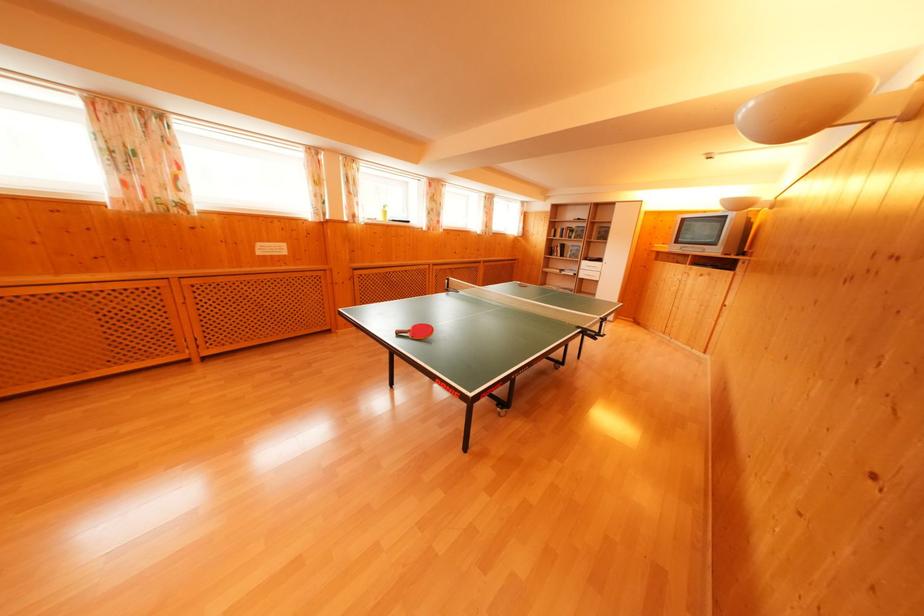
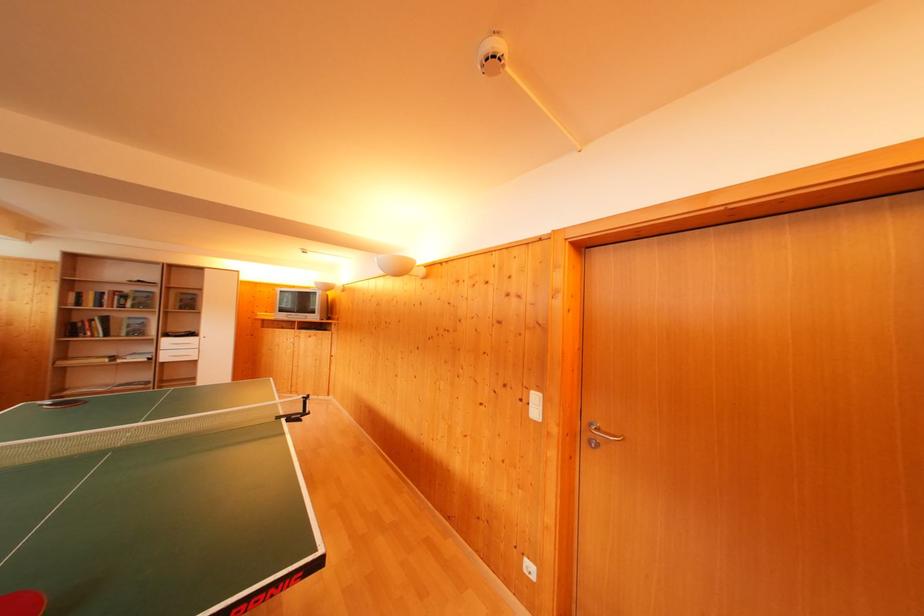
Where in the second image is the point corresponding to (x=554, y=256) from the first image?

(76, 334)